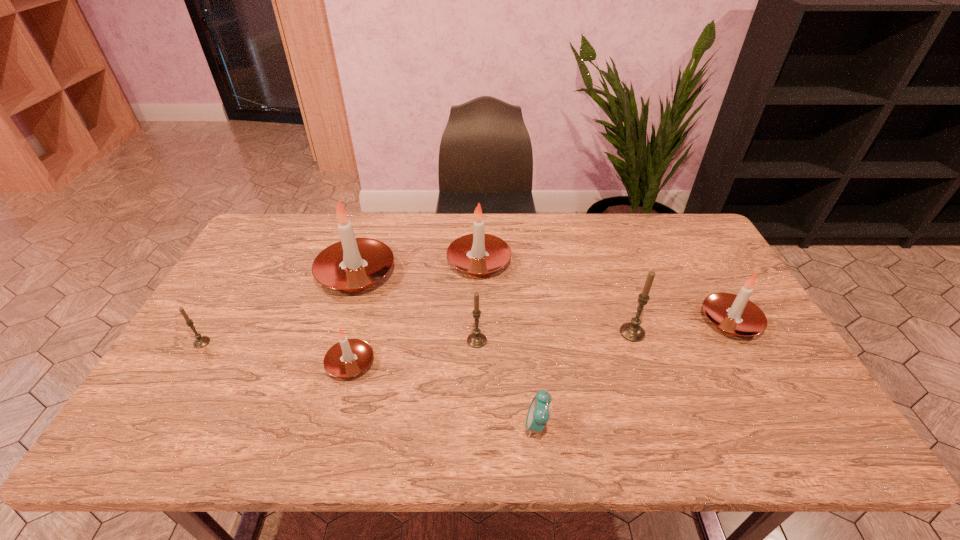
This screenshot has width=960, height=540. What are the coordinates of `the leftmost object` in the screenshot? It's located at (200, 342).

At what (x,y) coordinates should I click in order to perform the action: click on the sixth object from left to right. Please return your answer as a coordinate pair (x, y). Looking at the image, I should click on (538, 414).

Locate an element on the screen. The image size is (960, 540). alarm clock is located at coordinates (538, 414).

Find the location of a particular element. free spot located 0.130m on the front of the tallest object is located at coordinates (337, 334).

The width and height of the screenshot is (960, 540). Identify the location of free region located on the back of the second white candle from right to left. (479, 224).

At what (x,y) coordinates should I click in order to perform the action: click on free space located 0.300m on the back of the biggest gray candle. Please return your answer as a coordinate pair (x, y). Image resolution: width=960 pixels, height=540 pixels. Looking at the image, I should click on (607, 256).

Locate an element on the screen. Image resolution: width=960 pixels, height=540 pixels. vacant region located on the back of the rightmost object is located at coordinates (698, 264).

You are a GUI agent. You are given a task and a screenshot of the screen. Output one action in this format:
    pyautogui.click(x=<x>, y=<y>)
    Task: Click on the vacant space located on the right of the second smallest gray candle
    Image resolution: width=960 pixels, height=540 pixels.
    Given the screenshot: What is the action you would take?
    pyautogui.click(x=557, y=341)

Identify the location of free space located on the right of the nearest white candle. The width and height of the screenshot is (960, 540). (521, 363).

Locate an element on the screen. Image resolution: width=960 pixels, height=540 pixels. free space located 0.380m on the right of the leftmost gray candle is located at coordinates (350, 342).